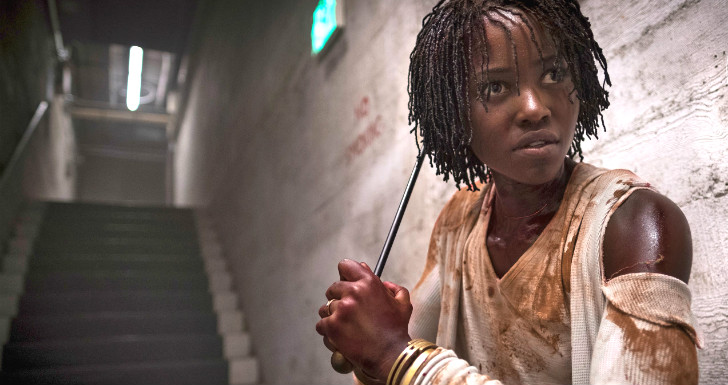
At what (x,y) coordinates should I click in order to perform the action: click on handrail. Please return your answer as a coordinate pair (x, y). The image size is (728, 385). Looking at the image, I should click on (19, 143).